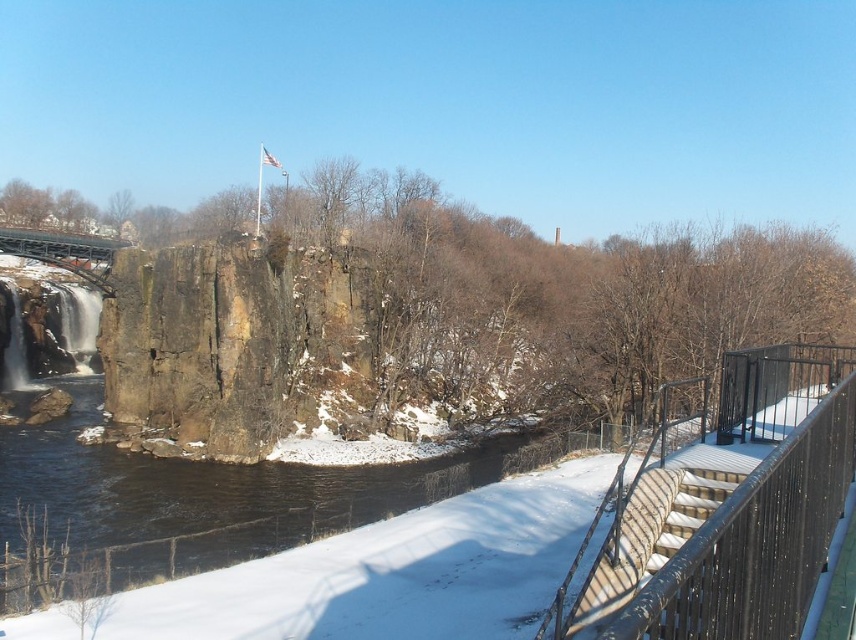
You are standing on the paved walkway and want to reach the cliff edge. The black metal railing at right is in your way. Can you move around it to get closer to the cliff edge?

The black metal railing at right is located at point (x=721, y=508), which is along the edge of the cliff. Since the railing is at the edge, you cannot move around it to get closer to the cliff edge as it is already at the edge itself.

You are standing at the edge of the cliff on the walkway and want to take a photo of both the point at coordinates point (742, 602) and the point at coordinates point (12, 237). Which point will appear larger in your camera view?

Point (742, 602) will appear larger in the camera view because it is closer to the camera than point (12, 237).

You are standing on the walkway and want to take a photo of the waterfall. The black metal railing at right is in your way. Can you move 15 feet away from the railing to get a clear shot?

The distance between you and the black metal railing at right is 16.49 feet, so moving 15 feet away from it would still keep you 1.49 feet away from the railing, allowing you to take the photo without obstruction.